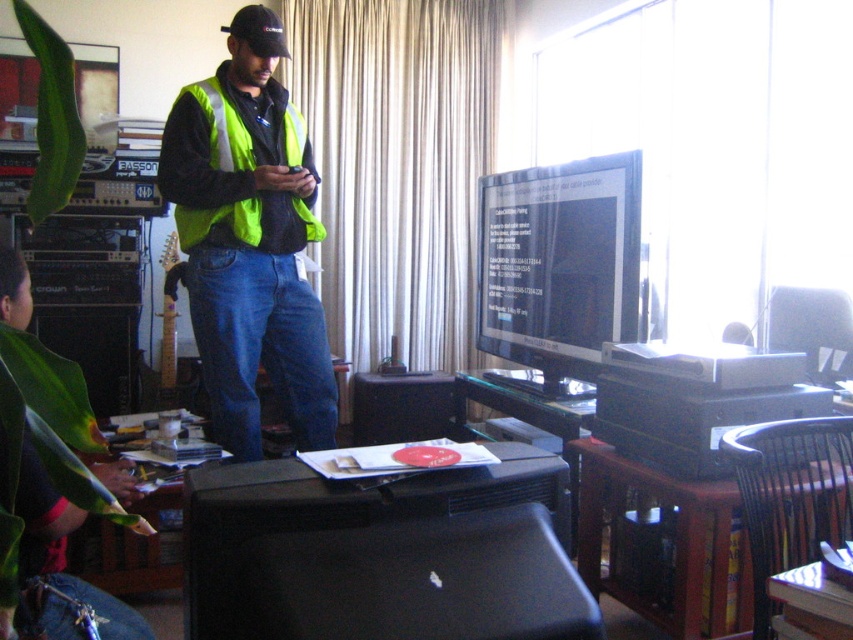
The black matte printer at lower center is located at coordinates 0.869 on the x axis and 0.449 on the y axis. If you were to draw a straight line from the center of the image to this point, in which cardinal direction would the line point? Please answer with one of the following options only north, south, east, west, northeast, northwest, southeast, or southwest.

The black matte printer at lower center is located at coordinates 0.869 on the x axis and 0.449 on the y axis. Since the x axis increases to the east and the y axis increases to the north, the point is southeast of the center.

You are a technician in the room and need to access the high visibility vest at center. Is the black matte printer at lower center blocking your direct path to it?

The black matte printer at lower center is located below the high visibility vest at center, so it is not blocking the direct path to the high visibility vest at center.